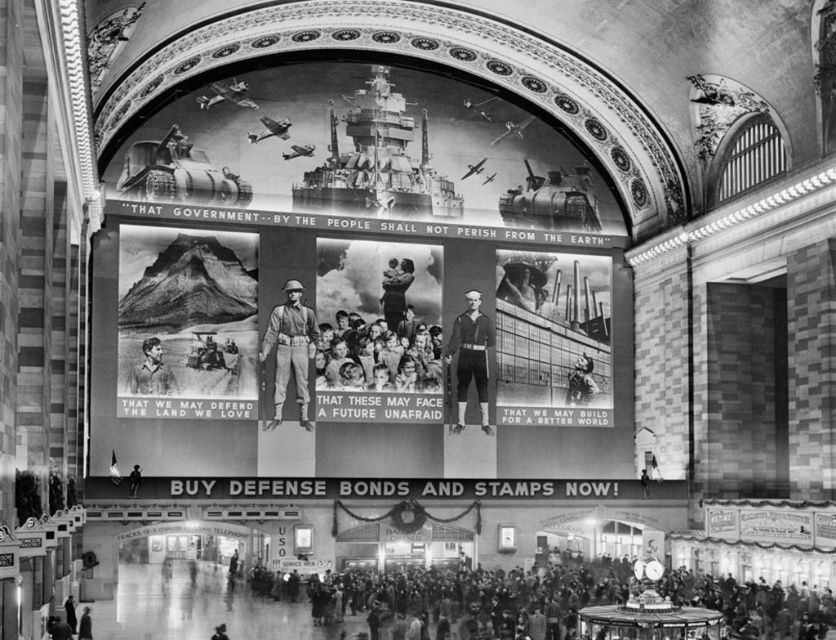
Between uniformed sailor at center and smooth skin baby at center, which one appears on the left side from the viewer's perspective?

smooth skin baby at center

Is point (487, 417) closer to viewer compared to point (388, 269)?

No.

Does point (466, 349) lie behind point (391, 284)?

Yes, point (466, 349) is farther from viewer.

Identify the location of uniformed sailor at center. The width and height of the screenshot is (836, 640). (470, 358).

From the picture: Is dark gray clothing at lower center below uniformed sailor at center?

Yes, dark gray clothing at lower center is below uniformed sailor at center.

Does point (569, 628) come closer to viewer compared to point (482, 426)?

Yes, it is in front of point (482, 426).

Locate an element on the screen. This screenshot has width=836, height=640. dark gray clothing at lower center is located at coordinates (478, 596).

Is grainy black-and-white mountain at center-left to the right of smooth skin baby at center from the viewer's perspective?

No, grainy black-and-white mountain at center-left is not to the right of smooth skin baby at center.

Does grainy black-and-white mountain at center-left appear on the left side of smooth skin baby at center?

Indeed, grainy black-and-white mountain at center-left is positioned on the left side of smooth skin baby at center.

The width and height of the screenshot is (836, 640). What do you see at coordinates (186, 323) in the screenshot?
I see `grainy black-and-white mountain at center-left` at bounding box center [186, 323].

Locate an element on the screen. grainy black-and-white mountain at center-left is located at coordinates (186, 323).